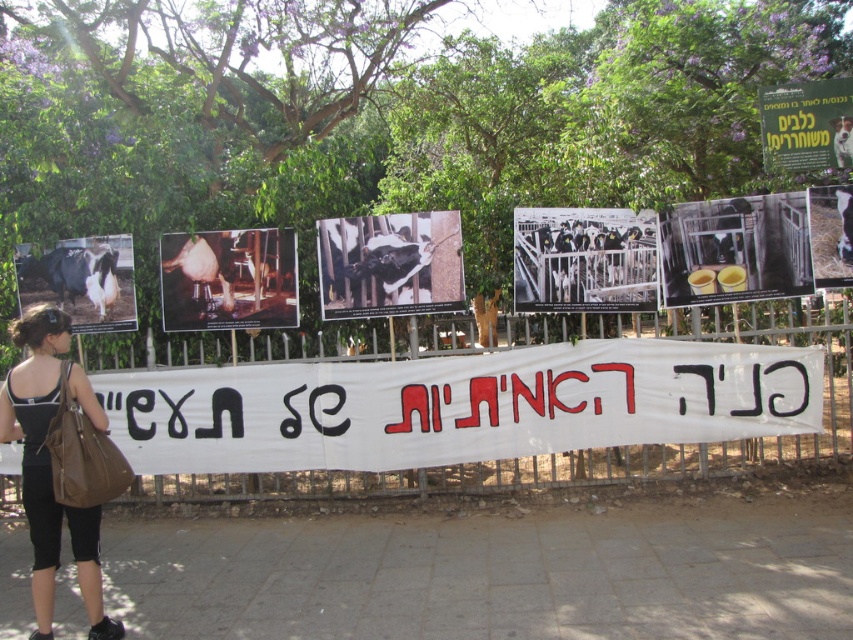
At what (x,y) coordinates should I click in order to perform the action: click on white fabric banner at center. Please return your answer as a coordinate pair (x, y). The width and height of the screenshot is (853, 640). Looking at the image, I should click on (459, 404).

Is white fabric banner at center above black glossy cows at center?

Actually, white fabric banner at center is below black glossy cows at center.

The width and height of the screenshot is (853, 640). What do you see at coordinates (459, 404) in the screenshot? I see `white fabric banner at center` at bounding box center [459, 404].

The width and height of the screenshot is (853, 640). Identify the location of white fabric banner at center. (459, 404).

Can you confirm if metallic silver cow at center is positioned above white paper poster at center?

Incorrect, metallic silver cow at center is not positioned above white paper poster at center.

Is metallic silver cow at center shorter than white paper poster at center?

No, metallic silver cow at center is not shorter than white paper poster at center.

Where is `metallic silver cow at center`? metallic silver cow at center is located at coordinates (228, 280).

Locate an element on the screen. metallic silver cow at center is located at coordinates (228, 280).

Is white glossy cow at center to the left of white paper poster at center from the viewer's perspective?

Yes, white glossy cow at center is to the left of white paper poster at center.

Between point (74, 243) and point (836, 220), which one is positioned behind?

The point (74, 243) is more distant.

Where is `white glossy cow at center`? The width and height of the screenshot is (853, 640). white glossy cow at center is located at coordinates (82, 280).